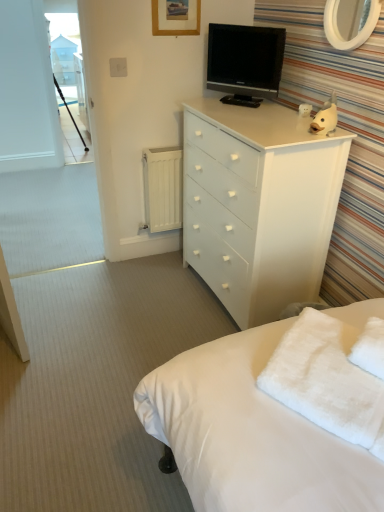
What do you see at coordinates (64, 25) in the screenshot?
I see `transparent glass window screen at upper left` at bounding box center [64, 25].

What do you see at coordinates (258, 204) in the screenshot? This screenshot has width=384, height=512. I see `white glossy chest of drawers at upper right` at bounding box center [258, 204].

The width and height of the screenshot is (384, 512). I want to click on white fluffy pillow at upper right, so click(370, 348).

Where is `white fluffy towel at lower right`? The width and height of the screenshot is (384, 512). white fluffy towel at lower right is located at coordinates (327, 380).

The width and height of the screenshot is (384, 512). What do you see at coordinates (163, 188) in the screenshot?
I see `white painted metal radiator at lower left` at bounding box center [163, 188].

Where is `transparent glass window screen at upper left`? transparent glass window screen at upper left is located at coordinates (64, 25).

Looking at this image, can you tell me how much transparent glass window screen at upper left and white matte fish at upper right differ in facing direction?

67.1 degrees.

How much distance is there between transparent glass window screen at upper left and white matte fish at upper right?

transparent glass window screen at upper left is 3.10 meters from white matte fish at upper right.

Looking at the image, does transparent glass window screen at upper left seem bigger or smaller compared to white matte fish at upper right?

Considering their sizes, transparent glass window screen at upper left takes up more space than white matte fish at upper right.

Which object is closer to the camera, transparent glass window screen at upper left or white matte fish at upper right?

white matte fish at upper right.

Which is more to the left, white fluffy towel at lower right or white glossy chest of drawers at upper right?

Positioned to the left is white glossy chest of drawers at upper right.

Is white fluffy towel at lower right oriented away from white glossy chest of drawers at upper right?

No, white fluffy towel at lower right is not facing the opposite direction of white glossy chest of drawers at upper right.

Considering the sizes of objects white fluffy towel at lower right and white glossy chest of drawers at upper right in the image provided, who is shorter, white fluffy towel at lower right or white glossy chest of drawers at upper right?

white fluffy towel at lower right.

Between white fluffy towel at lower right and white glossy chest of drawers at upper right, which one has larger width?

white glossy chest of drawers at upper right is wider.

Would you say white matte fish at upper right is to the left or to the right of black glossy tv at upper center in the picture?

white matte fish at upper right is positioned on black glossy tv at upper center's right side.

From a real-world perspective, is white matte fish at upper right under black glossy tv at upper center?

Yes, from a real-world perspective, white matte fish at upper right is beneath black glossy tv at upper center.

Which object is further away from the camera, white matte fish at upper right or black glossy tv at upper center?

black glossy tv at upper center is more distant.

Looking at this image, from the image's perspective, who appears lower, white matte fish at upper right or black glossy tv at upper center?

white matte fish at upper right, from the image's perspective.

Can you tell me how much white fluffy towel at lower right and white painted metal radiator at lower left differ in facing direction?

There is a 55.6-degree angle between the facing directions of white fluffy towel at lower right and white painted metal radiator at lower left.

In the scene shown: Can you confirm if white fluffy towel at lower right is taller than white painted metal radiator at lower left?

No, white fluffy towel at lower right is not taller than white painted metal radiator at lower left.

Visually, is white fluffy towel at lower right positioned to the left or to the right of white painted metal radiator at lower left?

Clearly, white fluffy towel at lower right is on the right of white painted metal radiator at lower left in the image.

From a real-world perspective, is white fluffy towel at lower right above or below white painted metal radiator at lower left?

In terms of real-world spatial position, white fluffy towel at lower right is above white painted metal radiator at lower left.

Is white glossy chest of drawers at upper right surrounded by transparent glass window screen at upper left?

No, transparent glass window screen at upper left does not contain white glossy chest of drawers at upper right.

Is transparent glass window screen at upper left bigger or smaller than white glossy chest of drawers at upper right?

In the image, transparent glass window screen at upper left appears to be smaller than white glossy chest of drawers at upper right.

Locate an element on the screen. The height and width of the screenshot is (512, 384). chest of drawers below the transparent glass window screen at upper left (from the image's perspective) is located at coordinates (258, 204).

Is transparent glass window screen at upper left placed right next to white glossy chest of drawers at upper right?

transparent glass window screen at upper left is not next to white glossy chest of drawers at upper right, and they're not touching.

Does white fluffy towel at lower right have a lesser height compared to white fluffy pillow at upper right?

No.

From the image's perspective, would you say white fluffy towel at lower right is positioned over white fluffy pillow at upper right?

No, from the image's perspective, white fluffy towel at lower right is not over white fluffy pillow at upper right.

Would you say white fluffy towel at lower right is outside white fluffy pillow at upper right?

Yes.

Does white fluffy towel at lower right appear on the right side of white fluffy pillow at upper right?

In fact, white fluffy towel at lower right is to the left of white fluffy pillow at upper right.

From the image's perspective, is white glossy mirror at upper right beneath transparent glass window screen at upper left?

Yes, from the image's perspective, white glossy mirror at upper right is beneath transparent glass window screen at upper left.

Is point (352, 0) positioned in front of point (58, 17)?

Yes, it is.

I want to click on mirror in front of the transparent glass window screen at upper left, so click(x=350, y=22).

Is white glossy mirror at upper right surrounding transparent glass window screen at upper left?

No, transparent glass window screen at upper left is not inside white glossy mirror at upper right.

Locate an element on the screen. window screen on the left of white matte fish at upper right is located at coordinates (64, 25).

Where is `the chest of drawers that is behind the white fluffy towel at lower right`? the chest of drawers that is behind the white fluffy towel at lower right is located at coordinates (258, 204).

Estimate the real-world distances between objects in this image. Which object is closer to transparent glass window screen at upper left, white glossy chest of drawers at upper right or black glossy tv at upper center?

The object closer to transparent glass window screen at upper left is black glossy tv at upper center.

When comparing their distances from white fluffy towel at lower right, does black glossy tv at upper center or white painted metal radiator at lower left seem closer?

black glossy tv at upper center is positioned closer to the anchor white fluffy towel at lower right.

Estimate the real-world distances between objects in this image. Which object is closer to wooden picture frame at upper center, white glossy mirror at upper right or white matte fish at upper right?

Among the two, white glossy mirror at upper right is located nearer to wooden picture frame at upper center.

When comparing their distances from white fluffy pillow at upper right, does white painted metal radiator at lower left or transparent glass window screen at upper left seem closer?

white painted metal radiator at lower left is closer to white fluffy pillow at upper right.

When comparing their distances from white glossy chest of drawers at upper right, does white glossy mirror at upper right or black glossy tv at upper center seem further?

white glossy mirror at upper right is further to white glossy chest of drawers at upper right.

Looking at this image, from the image, which object appears to be nearer to transparent glass window screen at upper left, white painted metal radiator at lower left or white glossy chest of drawers at upper right?

white painted metal radiator at lower left lies closer to transparent glass window screen at upper left than the other object.

Looking at the image, which one is located further to black glossy tv at upper center, white glossy mirror at upper right or white fluffy towel at lower right?

white fluffy towel at lower right.

In the scene shown: Considering their positions, is white glossy chest of drawers at upper right positioned further to white painted metal radiator at lower left than white glossy mirror at upper right?

The object further to white painted metal radiator at lower left is white glossy mirror at upper right.

You are a GUI agent. You are given a task and a screenshot of the screen. Output one action in this format:
    pyautogui.click(x=<x>, y=<y>)
    Task: Click on the radiator between wooden picture frame at upper center and transparent glass window screen at upper left along the z-axis
    
    Given the screenshot: What is the action you would take?
    pyautogui.click(x=163, y=188)

Locate an element on the screen. toy between white glossy mirror at upper right and white glossy chest of drawers at upper right from top to bottom is located at coordinates 326,116.

At what (x,y) coordinates should I click in order to perform the action: click on radiator between white glossy chest of drawers at upper right and transparent glass window screen at upper left along the z-axis. Please return your answer as a coordinate pair (x, y). Looking at the image, I should click on (163, 188).

At what (x,y) coordinates should I click in order to perform the action: click on radiator between white fluffy pillow at upper right and transparent glass window screen at upper left from front to back. Please return your answer as a coordinate pair (x, y). Looking at the image, I should click on pos(163,188).